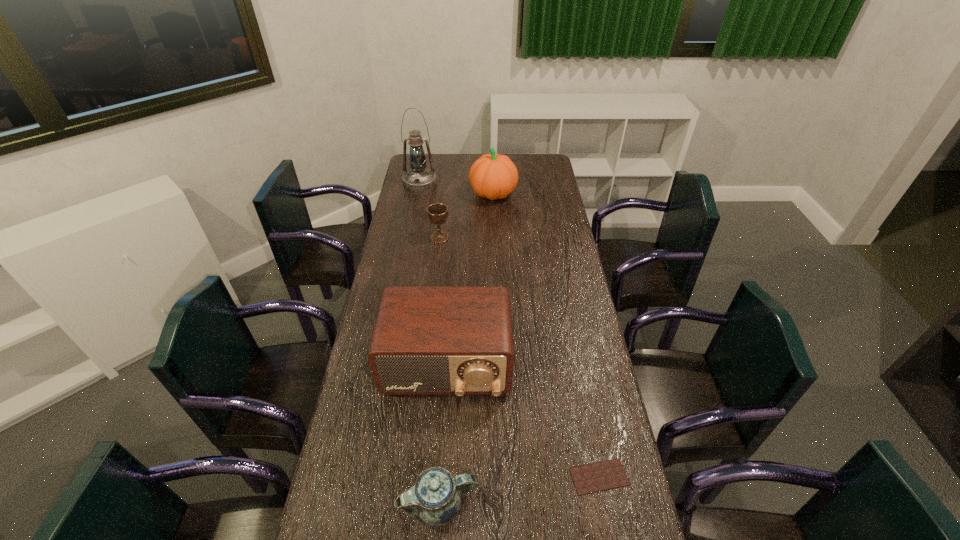
Point out which object is positioned as the fifth nearest to the chocolate bar. Please provide its 2D coordinates. Your answer should be formatted as a tuple, i.e. [(x, y)], where the tuple contains the x and y coordinates of a point satisfying the conditions above.

[(418, 178)]

At what (x,y) coordinates should I click in order to perform the action: click on object that can be found as the fifth closest to the radio receiver. Please return your answer as a coordinate pair (x, y). This screenshot has width=960, height=540. Looking at the image, I should click on (418, 178).

Where is `free region that satisfies the following two spatial constraints: 1. on the front side of the rightmost object; 2. from the spout of the chinaware`? free region that satisfies the following two spatial constraints: 1. on the front side of the rightmost object; 2. from the spout of the chinaware is located at coordinates (605, 504).